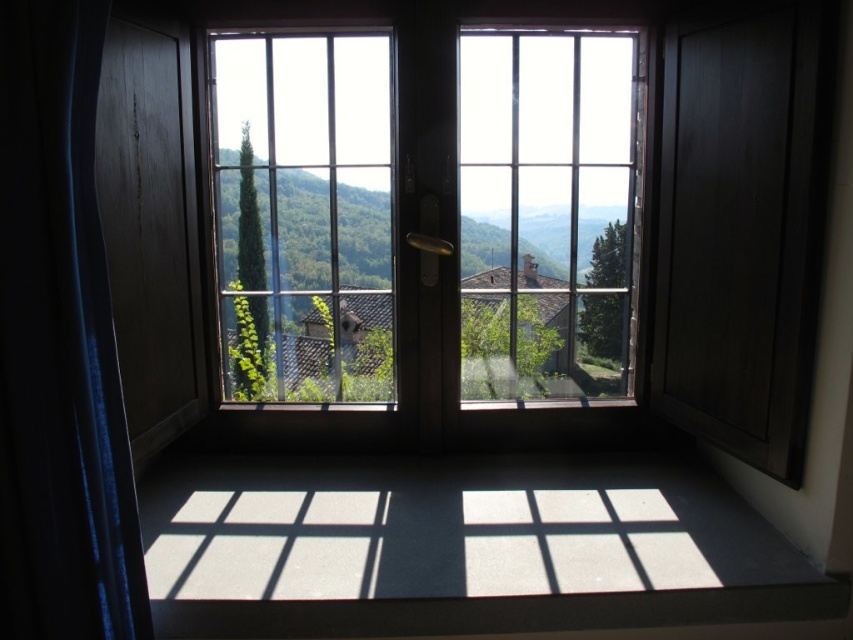
You are standing in the room and want to open the clear glass window at center to let in more light. However, there is a blue fabric curtain at left in the way. Can you open the window without moving the curtain?

The clear glass window at center is located above the blue fabric curtain at left, so you can open the window without moving the curtain since it is positioned above it.

You are a painter standing in the room and want to paint the view outside the window. You need to decide whether to position your easel closer to the clear glass window at center or the blue fabric curtain at left. Which object should you choose to ensure you have a clear view of the outside landscape?

The clear glass window at center is wider than the blue fabric curtain at left, so positioning the easel closer to the clear glass window at center will provide a clearer and wider view of the outside landscape.